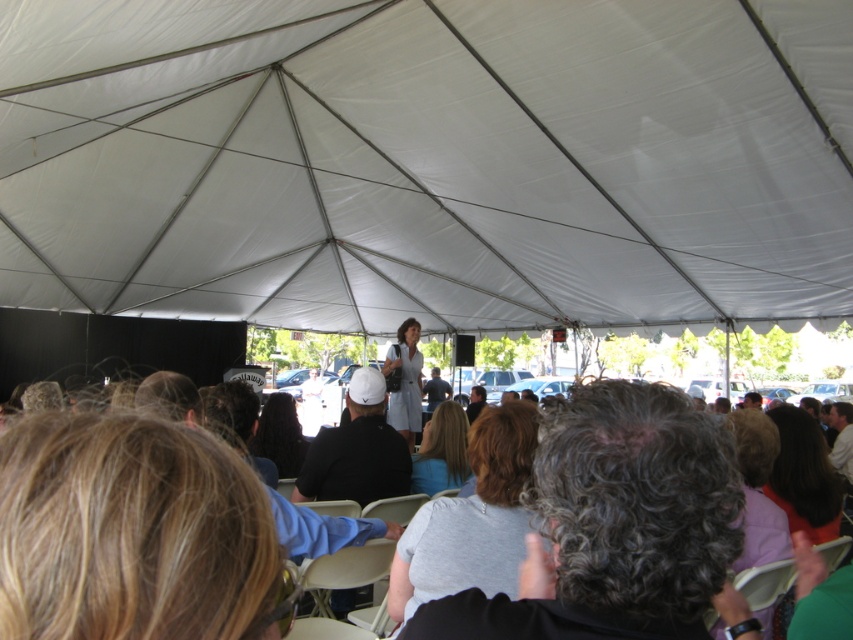
You are standing in the tent and want to walk towards the stage. There are two points marked in the image, point 1 at coordinates point [167,520] and point 2 at coordinates point [399,344]. Which point should you head towards to get closer to the stage?

Point [167,520] is closer to the viewer than point [399,344]. Therefore, you should head towards point [167,520] to get closer to the stage.

Looking at this image, you are organizing a small gathering and need to arrange seating for guests. Given the space occupied by the gray fabric chairs at center and the matte gray dress at center, which object takes up more space?

The matte gray dress at center takes up more space than the gray fabric chairs at center.